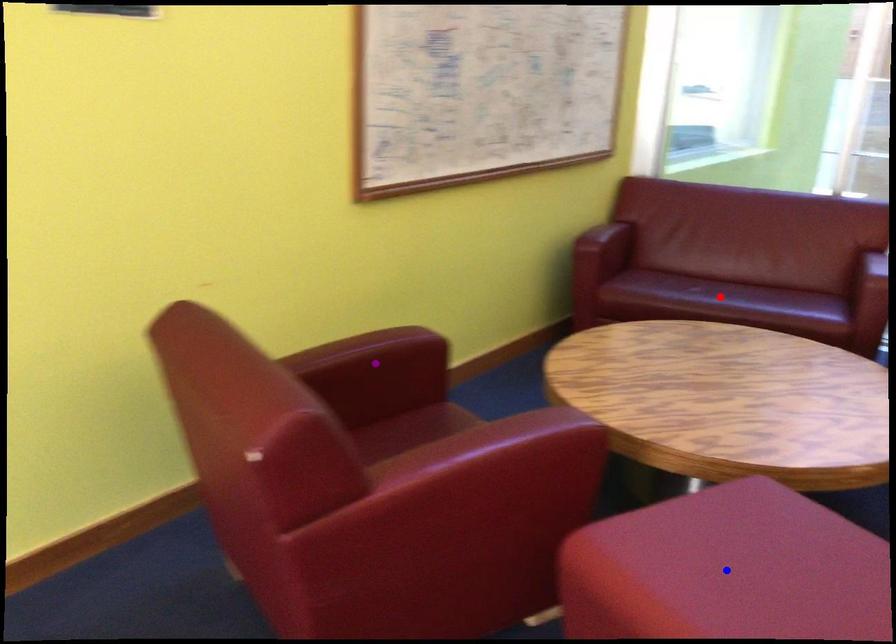
Order these from nearest to farthest:
blue point
purple point
red point

blue point
purple point
red point